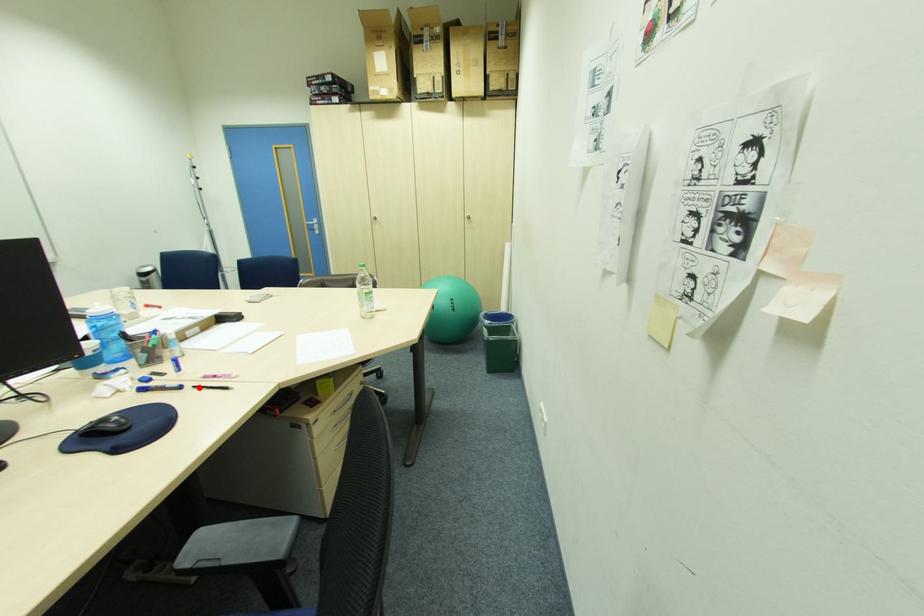
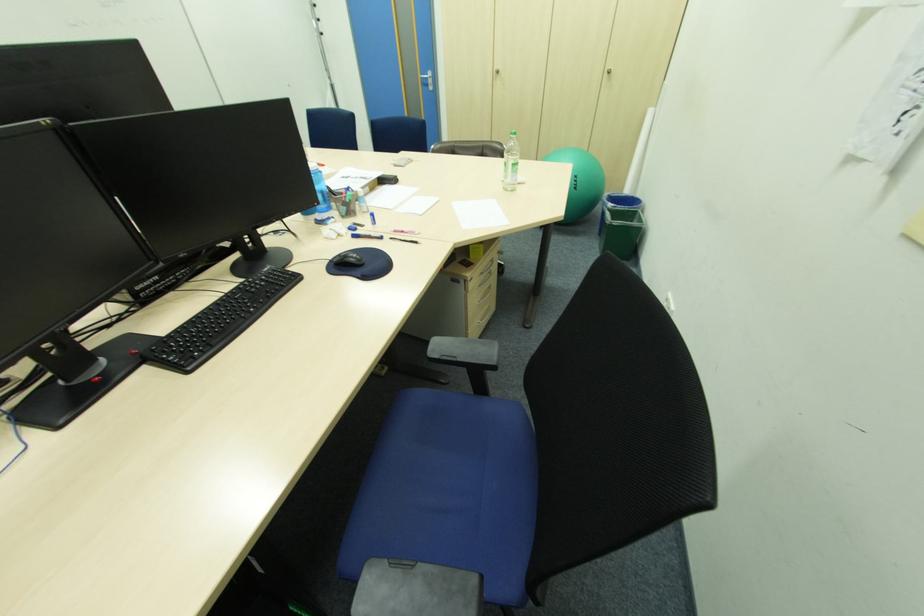
In the second image, find the point that corresponds to the highlighted location in the first image.

(396, 238)